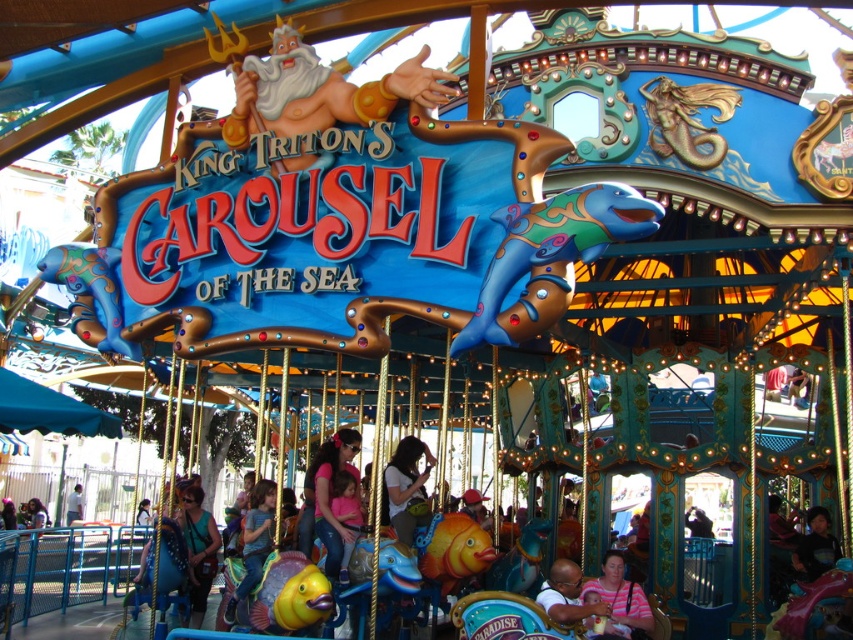
You are a guest at the carousel and want to find a spot where you can see both the entrance sign and the golden poles of the carousel clearly. The entrance sign is on the left side, and the golden poles are on the right side. You notice a point marked at coordinates (407, 486). Is this point a good location to stand to view both the entrance sign and the golden poles?

The point at (407, 486) marks the matte pink shirt at center, which is located centrally. Since the entrance sign is on the left and the golden poles are on the right, standing at the central location would provide a clear view of both areas. Therefore, this point is a good location to stand.

You are a parent at the entrance of King Triton s Carousel of the Sea. You see your child pointing at the striped fabric baby at lower right and the matte yellow fish at center. Which one is closer to the ground?

The striped fabric baby at lower right is below the matte yellow fish at center, so it is closer to the ground.